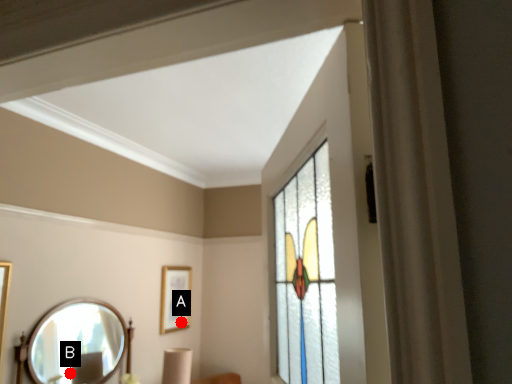
Question: Two points are circled on the image, labeled by A and B beside each circle. Which point is closer to the camera taking this photo?

Choices:
 (A) A is closer
 (B) B is closer

Answer: (B)